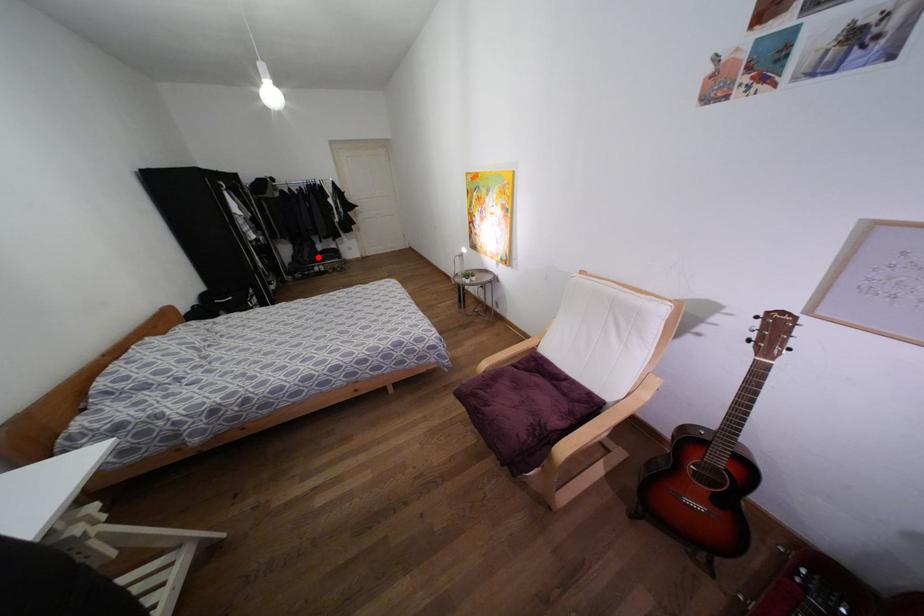
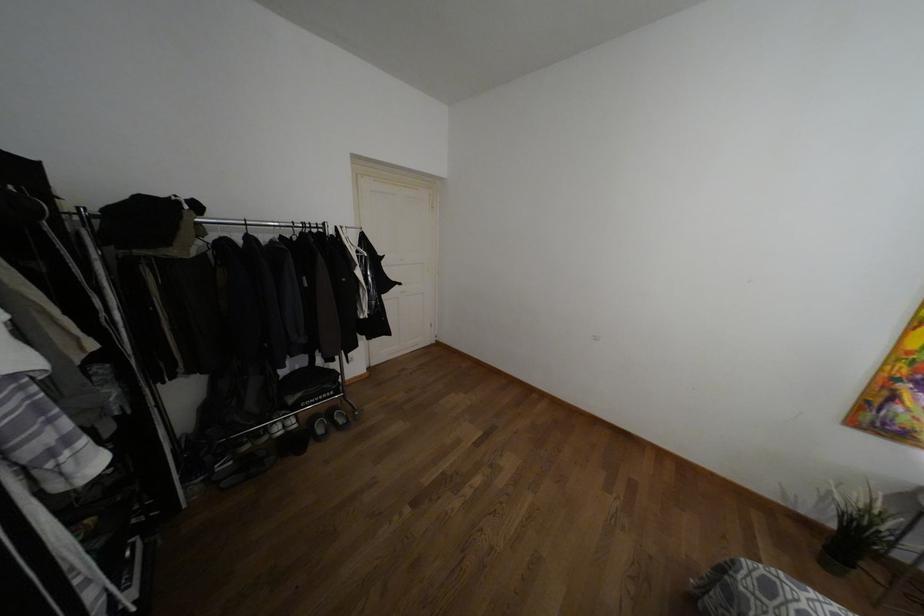
Question: I am providing you with two images of the same scene from different viewpoints. In image1, a red point is highlighted. Considering the same 3D point in image2, which of the following is correct?

Choices:
 (A) It is closer
 (B) It is farther

Answer: (B)